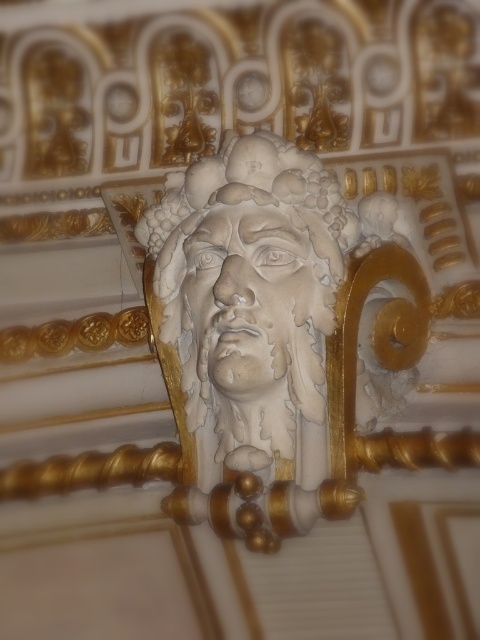
Question: Which point is farther to the camera?

Choices:
 (A) white stone face at center
 (B) white stone sculpture at center

Answer: (A)

Question: Observing the image, what is the correct spatial positioning of white stone sculpture at center in reference to white stone face at center?

Choices:
 (A) left
 (B) right

Answer: (A)

Question: From the image, what is the correct spatial relationship of white stone sculpture at center in relation to white stone face at center?

Choices:
 (A) above
 (B) below

Answer: (B)

Question: Is white stone sculpture at center above white stone face at center?

Choices:
 (A) no
 (B) yes

Answer: (A)

Question: Which object appears closest to the camera in this image?

Choices:
 (A) white stone face at center
 (B) white stone sculpture at center

Answer: (B)